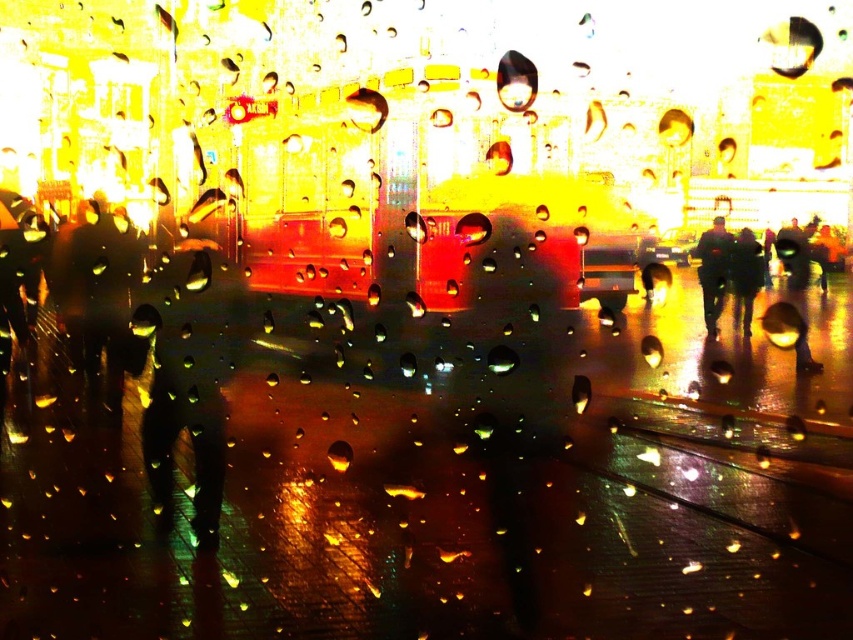
You are looking through a rain streaked window at night. You see two jackets hanging at the center of the window. The dark blue jacket at center and the dark gray fabric jacket at center. Which jacket takes up more space in your view?

The dark blue jacket at center takes up more space in your view because it is bigger than the dark gray fabric jacket at center.

You are a delivery person trying to hand a package to someone through a frosted glass window. You see two jackets at the center of the window, a dark blue jacket at center and a dark gray fabric jacket at center. Which jacket is closer to you?

The dark blue jacket at center is closer to you because the dark gray fabric jacket at center is behind it.